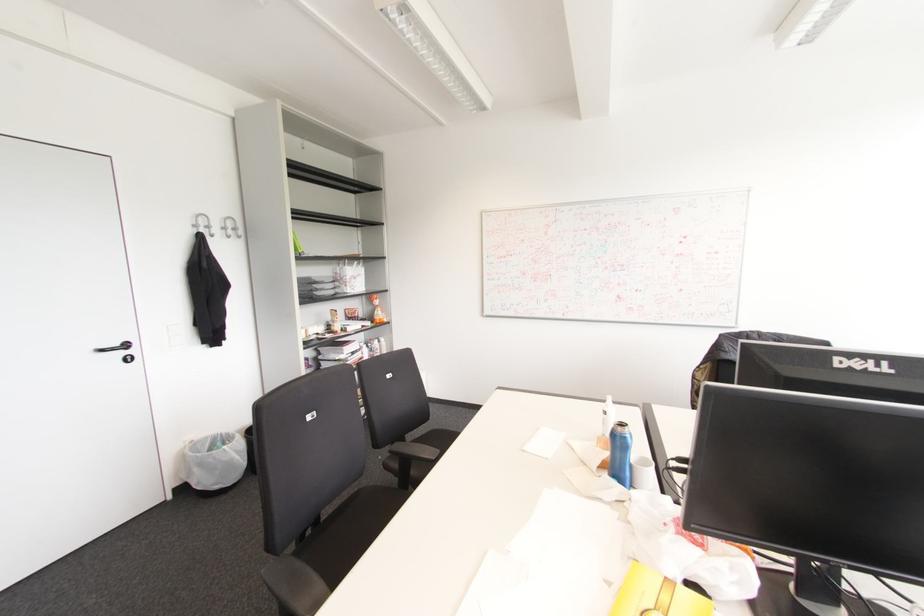
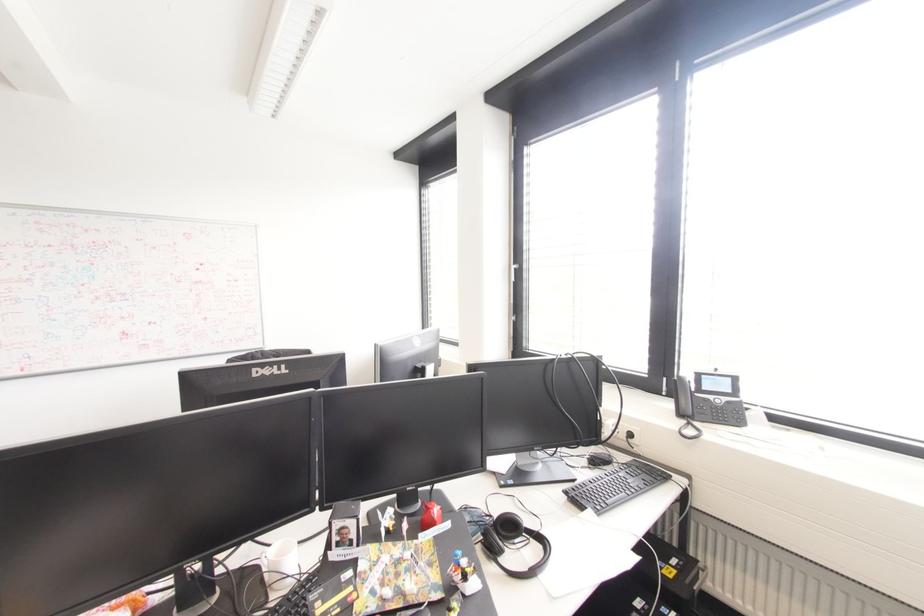
Question: The camera is either moving clockwise (left) or counter-clockwise (right) around the object. The first image is from the beginning of the video and the second image is from the end. Is the camera moving left or right when shooting the video?

Choices:
 (A) Left
 (B) Right

Answer: (A)